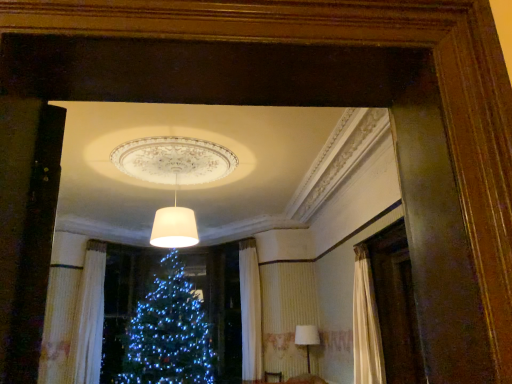
Question: Is white textured curtain at lower left located within white fabric lampshade at lower right, arranged as the 1th lamp when viewed from the back?

Choices:
 (A) no
 (B) yes

Answer: (A)

Question: Does white fabric lampshade at lower right, the second lamp from the top, come in front of white textured curtain at lower left?

Choices:
 (A) yes
 (B) no

Answer: (A)

Question: Is white fabric lampshade at lower right, the 1th lamp in the bottom-to-top sequence, shorter than white textured curtain at lower left?

Choices:
 (A) no
 (B) yes

Answer: (B)

Question: Is white fabric lampshade at lower right, the second lamp positioned from the front, not inside white textured curtain at lower left?

Choices:
 (A) no
 (B) yes

Answer: (B)

Question: Is white fabric lampshade at lower right, the second lamp positioned from the front, to the left of white textured curtain at lower left from the viewer's perspective?

Choices:
 (A) yes
 (B) no

Answer: (B)

Question: In terms of height, does white matte lampshade at center, acting as the first lamp starting from the left, look taller or shorter compared to white fabric lampshade at lower right, the second lamp from the top?

Choices:
 (A) short
 (B) tall

Answer: (A)

Question: Choose the correct answer: Is white matte lampshade at center, which is the first lamp in front-to-back order, inside white fabric lampshade at lower right, the second lamp positioned from the front, or outside it?

Choices:
 (A) inside
 (B) outside

Answer: (B)

Question: In terms of size, does white matte lampshade at center, the 2th lamp positioned from the right, appear bigger or smaller than white fabric lampshade at lower right, placed as the first lamp when sorted from right to left?

Choices:
 (A) big
 (B) small

Answer: (A)

Question: Relative to white fabric lampshade at lower right, the second lamp from the top, is white matte lampshade at center, arranged as the second lamp when ordered from the bottom, in front or behind?

Choices:
 (A) front
 (B) behind

Answer: (A)

Question: From a real-world perspective, is white textured curtain at lower left positioned above or below white matte lampshade at center, the first lamp positioned from the top?

Choices:
 (A) below
 (B) above

Answer: (A)

Question: Is white textured curtain at lower left inside or outside of white matte lampshade at center, the 2th lamp positioned from the right?

Choices:
 (A) outside
 (B) inside

Answer: (A)

Question: Considering the positions of white textured curtain at lower left and white matte lampshade at center, which is the first lamp in front-to-back order, in the image, is white textured curtain at lower left taller or shorter than white matte lampshade at center, which is the first lamp in front-to-back order,?

Choices:
 (A) short
 (B) tall

Answer: (B)

Question: Is white textured curtain at lower left in front of or behind white matte lampshade at center, the first lamp positioned from the top, in the image?

Choices:
 (A) behind
 (B) front

Answer: (A)

Question: Based on their sizes in the image, would you say white fabric lampshade at lower right, the second lamp positioned from the front, is bigger or smaller than white matte lampshade at center, which appears as the second lamp when viewed from the back?

Choices:
 (A) big
 (B) small

Answer: (B)

Question: From the image's perspective, is white fabric lampshade at lower right, the 1th lamp in the bottom-to-top sequence, located above or below white matte lampshade at center, which appears as the second lamp when viewed from the back?

Choices:
 (A) below
 (B) above

Answer: (A)